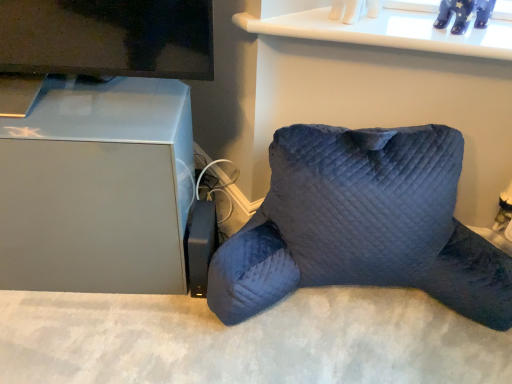
Question: Is velvet blue pillow at lower right positioned in front of matte gray cabinet at left?

Choices:
 (A) yes
 (B) no

Answer: (A)

Question: Is velvet blue pillow at lower right taller than matte gray cabinet at left?

Choices:
 (A) no
 (B) yes

Answer: (A)

Question: From a real-world perspective, is velvet blue pillow at lower right physically below matte gray cabinet at left?

Choices:
 (A) yes
 (B) no

Answer: (A)

Question: Considering the relative sizes of velvet blue pillow at lower right and matte gray cabinet at left in the image provided, is velvet blue pillow at lower right bigger than matte gray cabinet at left?

Choices:
 (A) no
 (B) yes

Answer: (B)

Question: Is velvet blue pillow at lower right oriented towards matte gray cabinet at left?

Choices:
 (A) yes
 (B) no

Answer: (B)

Question: Does velvet blue pillow at lower right have a lesser width compared to matte gray cabinet at left?

Choices:
 (A) no
 (B) yes

Answer: (A)

Question: From the image's perspective, would you say matte gray cabinet at left is positioned over velvet blue pillow at lower right?

Choices:
 (A) no
 (B) yes

Answer: (B)

Question: From a real-world perspective, is matte gray cabinet at left on top of velvet blue pillow at lower right?

Choices:
 (A) yes
 (B) no

Answer: (A)

Question: Is matte gray cabinet at left at the right side of velvet blue pillow at lower right?

Choices:
 (A) no
 (B) yes

Answer: (A)

Question: Is matte gray cabinet at left touching velvet blue pillow at lower right?

Choices:
 (A) no
 (B) yes

Answer: (A)

Question: Is matte gray cabinet at left wider than velvet blue pillow at lower right?

Choices:
 (A) yes
 (B) no

Answer: (B)

Question: Is matte gray cabinet at left not near velvet blue pillow at lower right?

Choices:
 (A) no
 (B) yes

Answer: (A)

Question: In terms of height, does velvet blue pillow at lower right look taller or shorter compared to matte gray cabinet at left?

Choices:
 (A) tall
 (B) short

Answer: (B)